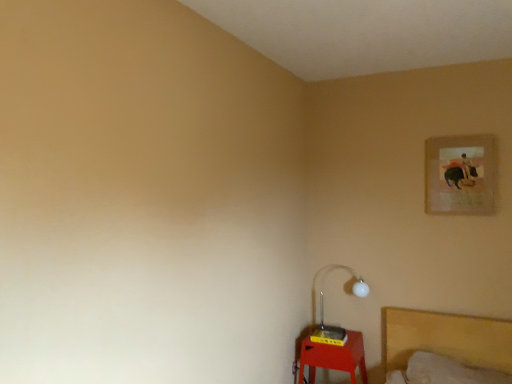
Question: Is yellow plastic table at lower right wider or thinner than white glossy lamp at lower right?

Choices:
 (A) thin
 (B) wide

Answer: (B)

Question: Is yellow plastic table at lower right situated inside white glossy lamp at lower right or outside?

Choices:
 (A) inside
 (B) outside

Answer: (B)

Question: Which of these objects is positioned farthest from the matte paper picture frame at upper right?

Choices:
 (A) white glossy lamp at lower right
 (B) yellow plastic table at lower right

Answer: (B)

Question: Which of these objects is positioned farthest from the yellow plastic table at lower right?

Choices:
 (A) matte paper picture frame at upper right
 (B) white glossy lamp at lower right

Answer: (A)